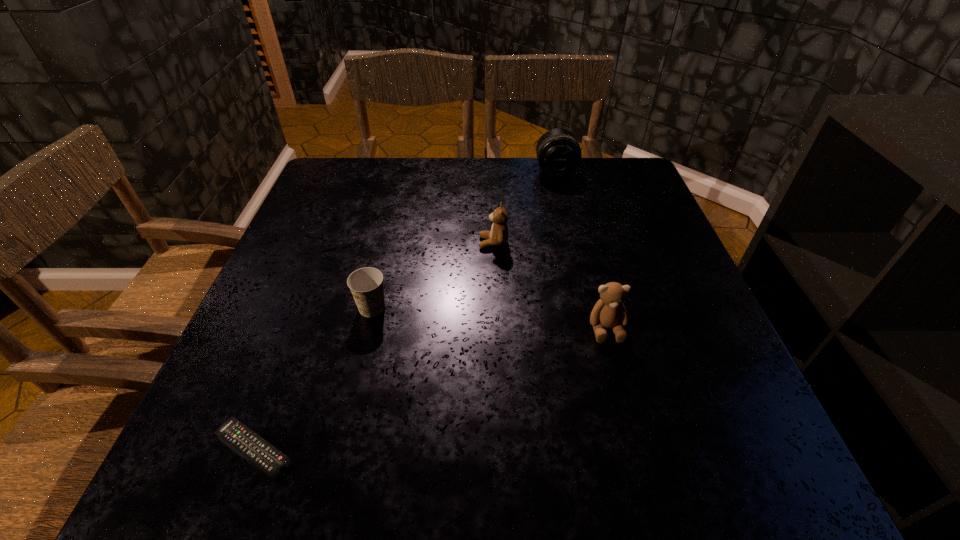
This screenshot has width=960, height=540. In the image, there is a desktop. What are the coordinates of `vacant space at the near edge` in the screenshot? It's located at (544, 490).

Where is `vacant space at the left edge of the desktop`? The width and height of the screenshot is (960, 540). vacant space at the left edge of the desktop is located at coordinates (302, 298).

At what (x,y) coordinates should I click in order to perform the action: click on vacant space at the right edge of the desktop. Please return your answer as a coordinate pair (x, y). Looking at the image, I should click on (635, 227).

Find the location of a particular element. vacant space at the far left corner is located at coordinates (377, 170).

Where is `blank space at the near right corner of the desktop`? The image size is (960, 540). blank space at the near right corner of the desktop is located at coordinates (709, 482).

Where is `free space between the right teddy bear and the remote control`? free space between the right teddy bear and the remote control is located at coordinates (430, 389).

The width and height of the screenshot is (960, 540). I want to click on free spot between the fourth object from right to left and the third object from left to right, so click(x=433, y=275).

The image size is (960, 540). I want to click on empty space that is in between the farther teddy bear and the farthest object, so click(x=524, y=206).

What are the coordinates of `vacant region between the Dixie cup and the nearest object` in the screenshot? It's located at (313, 379).

Image resolution: width=960 pixels, height=540 pixels. Identify the location of free space between the farthest object and the shortest object. (404, 309).